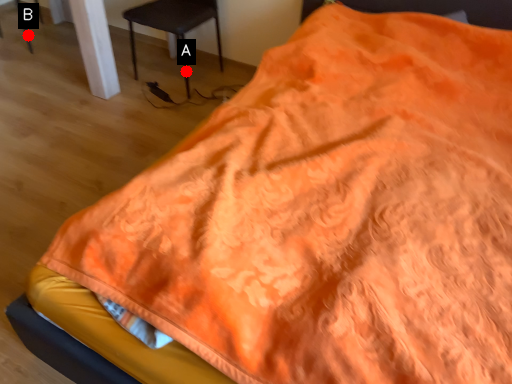
Question: Two points are circled on the image, labeled by A and B beside each circle. Which of the following is the closest to the observer?

Choices:
 (A) A is closer
 (B) B is closer

Answer: (A)